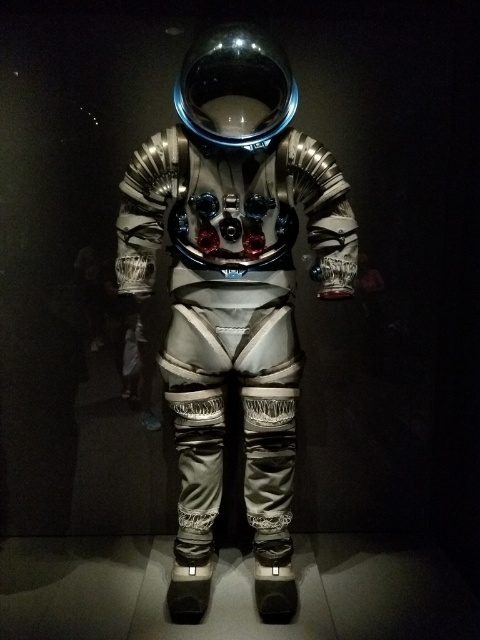
Question: Can you confirm if silver metallic astronaut at center is positioned above glossy metallic helmet at upper center?

Choices:
 (A) yes
 (B) no

Answer: (B)

Question: Does silver metallic astronaut at center have a lesser width compared to glossy metallic helmet at upper center?

Choices:
 (A) no
 (B) yes

Answer: (A)

Question: Which point is closer to the camera?

Choices:
 (A) (195, 88)
 (B) (186, 80)

Answer: (A)

Question: Is silver metallic astronaut at center positioned before glossy metallic helmet at upper center?

Choices:
 (A) no
 (B) yes

Answer: (A)

Question: Among these points, which one is farthest from the camera?

Choices:
 (A) (229, 58)
 (B) (254, 371)

Answer: (B)